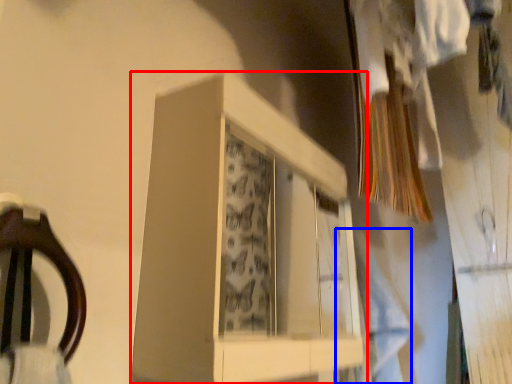
Question: Which object is closer to the camera taking this photo, cabinet (highlighted by a red box) or clothing (highlighted by a blue box)?

Choices:
 (A) cabinet
 (B) clothing

Answer: (A)